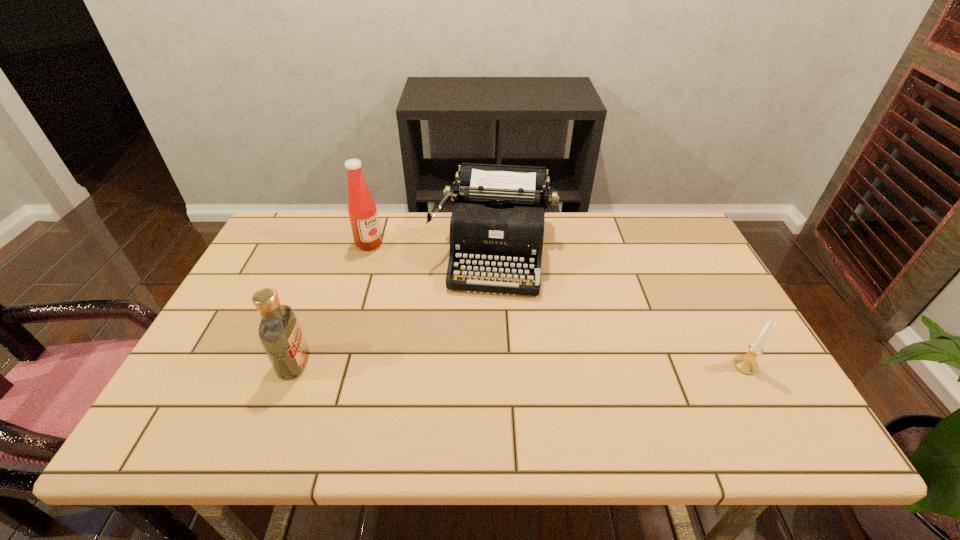
The height and width of the screenshot is (540, 960). In order to click on free space at the far edge of the desktop in this screenshot , I will do `click(594, 235)`.

Find the location of a particular element. This screenshot has width=960, height=540. vacant region at the near edge of the desktop is located at coordinates (333, 391).

Image resolution: width=960 pixels, height=540 pixels. What are the coordinates of `vacant space at the left edge of the desktop` in the screenshot? It's located at (259, 320).

In order to click on vacant space at the right edge in this screenshot , I will do `click(716, 280)`.

The width and height of the screenshot is (960, 540). What are the coordinates of `vacant space at the far left corner of the desktop` in the screenshot? It's located at (291, 255).

Where is `vacant area at the near left corner`? This screenshot has width=960, height=540. vacant area at the near left corner is located at coordinates (199, 381).

Locate an element on the screen. The width and height of the screenshot is (960, 540). vacant region at the far right corner of the desktop is located at coordinates (665, 222).

You are a GUI agent. You are given a task and a screenshot of the screen. Output one action in this format:
    pyautogui.click(x=<x>, y=<y>)
    Task: Click on the vacant region between the shortest object and the vodka
    
    Given the screenshot: What is the action you would take?
    pyautogui.click(x=519, y=364)

Find the location of a particular element. The width and height of the screenshot is (960, 540). empty space between the shortest object and the typewriter is located at coordinates (619, 308).

What are the coordinates of `free space between the second object from left to right and the vodka` in the screenshot? It's located at (331, 303).